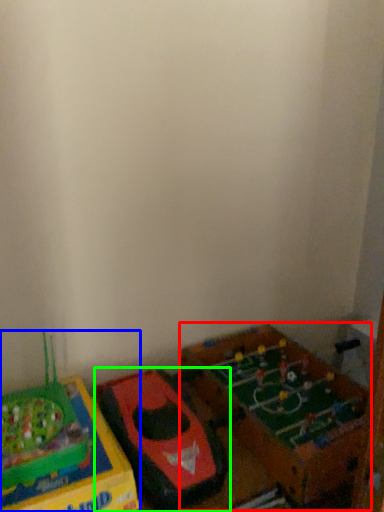
Question: Which object is the closest to the toy (highlighted by a red box)? Choose among these: toy (highlighted by a blue box) or toy (highlighted by a green box).

Choices:
 (A) toy
 (B) toy

Answer: (B)